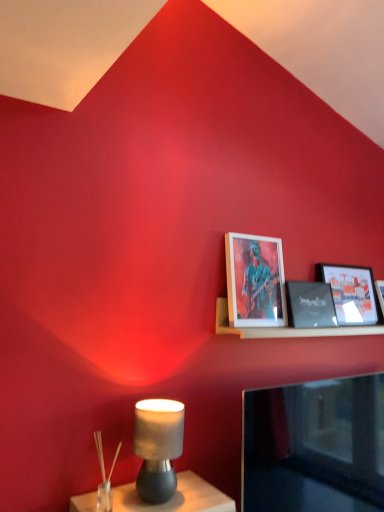
What do you see at coordinates (310, 305) in the screenshot?
I see `matte black picture frame at upper right, the second picture frame viewed from the right` at bounding box center [310, 305].

Where is `matte black picture frame at upper right, the second picture frame viewed from the right`? This screenshot has width=384, height=512. matte black picture frame at upper right, the second picture frame viewed from the right is located at coordinates (310, 305).

This screenshot has height=512, width=384. Identify the location of wooden shelf at upper right. (285, 328).

Identify the location of matte black picture frame at upper right, placed as the third picture frame when sorted from left to right. The width and height of the screenshot is (384, 512). (352, 293).

In the scene shown: In terms of height, does matte gray lamp at lower left look taller or shorter compared to wooden frame at upper right, marked as the 1th picture frame in a left-to-right arrangement?

In the image, matte gray lamp at lower left appears to be shorter than wooden frame at upper right, marked as the 1th picture frame in a left-to-right arrangement.

Is matte gray lamp at lower left wider or thinner than wooden frame at upper right, marked as the 1th picture frame in a left-to-right arrangement?

Clearly, matte gray lamp at lower left has more width compared to wooden frame at upper right, marked as the 1th picture frame in a left-to-right arrangement.

Based on the photo, which is closer to the camera, [176,401] or [268,298]?

Clearly, point [176,401] is closer to the camera than point [268,298].

From a real-world perspective, does matte black picture frame at upper right, acting as the 2th picture frame starting from the left, stand above matte gray lamp at lower left?

Correct, in the physical world, matte black picture frame at upper right, acting as the 2th picture frame starting from the left, is higher than matte gray lamp at lower left.

From the picture: Between matte black picture frame at upper right, acting as the 2th picture frame starting from the left, and matte gray lamp at lower left, which one is positioned behind?

matte black picture frame at upper right, acting as the 2th picture frame starting from the left, is behind.

From the matte gray lamp at lower left, count 2nd picture frame to the right and point to it. Please provide its 2D coordinates.

[(310, 305)]

Is matte black picture frame at upper right, acting as the 2th picture frame starting from the left, positioned far away from matte gray lamp at lower left?

No, matte black picture frame at upper right, acting as the 2th picture frame starting from the left, is in close proximity to matte gray lamp at lower left.

At what (x,y) coordinates should I click in order to perform the action: click on shelf lying on the right of matte black picture frame at upper right, acting as the 2th picture frame starting from the left. Please return your answer as a coordinate pair (x, y). Looking at the image, I should click on (285, 328).

From a real-world perspective, between wooden shelf at upper right and matte black picture frame at upper right, the second picture frame viewed from the right, who is vertically higher?

In real-world perspective, matte black picture frame at upper right, the second picture frame viewed from the right, is above.

Is wooden shelf at upper right oriented towards matte black picture frame at upper right, acting as the 2th picture frame starting from the left?

Yes, wooden shelf at upper right is oriented towards matte black picture frame at upper right, acting as the 2th picture frame starting from the left.

Is wooden shelf at upper right located outside matte black picture frame at upper right, the second picture frame viewed from the right?

wooden shelf at upper right lies outside matte black picture frame at upper right, the second picture frame viewed from the right,'s area.

Is point (320, 330) positioned before point (374, 322)?

Yes, it is.

From a real-world perspective, is wooden shelf at upper right positioned over matte black picture frame at upper right, the 1th picture frame viewed from the right, based on gravity?

Actually, wooden shelf at upper right is physically below matte black picture frame at upper right, the 1th picture frame viewed from the right, in the real world.

Looking at the image, does wooden shelf at upper right seem bigger or smaller compared to matte black picture frame at upper right, the 1th picture frame viewed from the right?

wooden shelf at upper right is bigger than matte black picture frame at upper right, the 1th picture frame viewed from the right.

Is wooden shelf at upper right at the right side of matte black picture frame at upper right, the 1th picture frame viewed from the right?

No, wooden shelf at upper right is not to the right of matte black picture frame at upper right, the 1th picture frame viewed from the right.

Are matte black picture frame at upper right, placed as the third picture frame when sorted from left to right, and black glossy tv at lower right making contact?

No, matte black picture frame at upper right, placed as the third picture frame when sorted from left to right, is not in contact with black glossy tv at lower right.

Where is `picture frame that is the 3rd one when counting backward from the black glossy tv at lower right`? Image resolution: width=384 pixels, height=512 pixels. picture frame that is the 3rd one when counting backward from the black glossy tv at lower right is located at coordinates (352, 293).

Looking at this image, relative to black glossy tv at lower right, is matte black picture frame at upper right, placed as the third picture frame when sorted from left to right, in front or behind?

Visually, matte black picture frame at upper right, placed as the third picture frame when sorted from left to right, is located behind black glossy tv at lower right.

Looking at this image, is matte black picture frame at upper right, the 1th picture frame viewed from the right, not inside black glossy tv at lower right?

Yes, matte black picture frame at upper right, the 1th picture frame viewed from the right, is outside of black glossy tv at lower right.

From a real-world perspective, who is located lower, black glossy tv at lower right or matte black picture frame at upper right, acting as the 2th picture frame starting from the left?

black glossy tv at lower right is physically lower.

Could you measure the distance between black glossy tv at lower right and matte black picture frame at upper right, the second picture frame viewed from the right?

They are 19.45 inches apart.

Is black glossy tv at lower right far away from matte black picture frame at upper right, acting as the 2th picture frame starting from the left?

black glossy tv at lower right is actually quite close to matte black picture frame at upper right, acting as the 2th picture frame starting from the left.

Relative to matte black picture frame at upper right, the second picture frame viewed from the right, is black glossy tv at lower right in front or behind?

Clearly, black glossy tv at lower right is in front of matte black picture frame at upper right, the second picture frame viewed from the right.

From a real-world perspective, is matte black picture frame at upper right, the second picture frame viewed from the right, over matte black picture frame at upper right, the 1th picture frame viewed from the right?

Incorrect, from a real-world perspective, matte black picture frame at upper right, the second picture frame viewed from the right, is lower than matte black picture frame at upper right, the 1th picture frame viewed from the right.

Considering the relative sizes of matte black picture frame at upper right, the second picture frame viewed from the right, and matte black picture frame at upper right, placed as the third picture frame when sorted from left to right, in the image provided, is matte black picture frame at upper right, the second picture frame viewed from the right, taller than matte black picture frame at upper right, placed as the third picture frame when sorted from left to right,?

No, matte black picture frame at upper right, the second picture frame viewed from the right, is not taller than matte black picture frame at upper right, placed as the third picture frame when sorted from left to right.

Considering the relative positions of matte black picture frame at upper right, the second picture frame viewed from the right, and matte black picture frame at upper right, placed as the third picture frame when sorted from left to right, in the image provided, is matte black picture frame at upper right, the second picture frame viewed from the right, to the left of matte black picture frame at upper right, placed as the third picture frame when sorted from left to right, from the viewer's perspective?

Yes, matte black picture frame at upper right, the second picture frame viewed from the right, is to the left of matte black picture frame at upper right, placed as the third picture frame when sorted from left to right.

This screenshot has height=512, width=384. Find the location of `picture frame below the matte black picture frame at upper right, the 1th picture frame viewed from the right (from the image's perspective)`. picture frame below the matte black picture frame at upper right, the 1th picture frame viewed from the right (from the image's perspective) is located at coordinates click(310, 305).

From a real-world perspective, count 3rd picture frames upward from the matte gray lamp at lower left and point to it. Please provide its 2D coordinates.

[(255, 281)]

You are a GUI agent. You are given a task and a screenshot of the screen. Output one action in this format:
    pyautogui.click(x=<x>, y=<y>)
    Task: Click on the table lamp on the left of matte black picture frame at upper right, acting as the 2th picture frame starting from the left
    The image size is (384, 512).
    Given the screenshot: What is the action you would take?
    point(158,447)

Based on their spatial positions, is wooden frame at upper right, marked as the 1th picture frame in a left-to-right arrangement, or black glossy tv at lower right further from wooden shelf at upper right?

Among the two, black glossy tv at lower right is located further to wooden shelf at upper right.

Estimate the real-world distances between objects in this image. Which object is further from matte black picture frame at upper right, the 1th picture frame viewed from the right, wooden shelf at upper right or black glossy tv at lower right?

Among the two, black glossy tv at lower right is located further to matte black picture frame at upper right, the 1th picture frame viewed from the right.

Looking at the image, which one is located further to matte gray lamp at lower left, black glossy tv at lower right or wooden frame at upper right, marked as the 1th picture frame in a left-to-right arrangement?

The object further to matte gray lamp at lower left is wooden frame at upper right, marked as the 1th picture frame in a left-to-right arrangement.

Which object lies nearer to the anchor point black glossy tv at lower right, matte gray lamp at lower left or wooden shelf at upper right?

The object closer to black glossy tv at lower right is wooden shelf at upper right.

Estimate the real-world distances between objects in this image. Which object is closer to wooden shelf at upper right, black glossy tv at lower right or wooden frame at upper right, acting as the 3th picture frame starting from the right?

Based on the image, wooden frame at upper right, acting as the 3th picture frame starting from the right, appears to be nearer to wooden shelf at upper right.

Estimate the real-world distances between objects in this image. Which object is further from matte gray lamp at lower left, black glossy tv at lower right or matte black picture frame at upper right, the second picture frame viewed from the right?

Among the two, matte black picture frame at upper right, the second picture frame viewed from the right, is located further to matte gray lamp at lower left.

Looking at the image, which one is located closer to matte gray lamp at lower left, wooden shelf at upper right or matte black picture frame at upper right, placed as the third picture frame when sorted from left to right?

wooden shelf at upper right.

From the picture: When comparing their distances from matte black picture frame at upper right, the second picture frame viewed from the right, does black glossy tv at lower right or wooden shelf at upper right seem further?

black glossy tv at lower right.

Where is `shelf between wooden frame at upper right, marked as the 1th picture frame in a left-to-right arrangement, and matte black picture frame at upper right, placed as the third picture frame when sorted from left to right, from left to right`? Image resolution: width=384 pixels, height=512 pixels. shelf between wooden frame at upper right, marked as the 1th picture frame in a left-to-right arrangement, and matte black picture frame at upper right, placed as the third picture frame when sorted from left to right, from left to right is located at coordinates (285, 328).

This screenshot has height=512, width=384. Identify the location of shelf between wooden frame at upper right, acting as the 3th picture frame starting from the right, and black glossy tv at lower right vertically. (285, 328).

The image size is (384, 512). Find the location of `shelf that lies between matte black picture frame at upper right, placed as the third picture frame when sorted from left to right, and black glossy tv at lower right from top to bottom`. shelf that lies between matte black picture frame at upper right, placed as the third picture frame when sorted from left to right, and black glossy tv at lower right from top to bottom is located at coordinates (285, 328).

At what (x,y) coordinates should I click in order to perform the action: click on shelf located between matte gray lamp at lower left and matte black picture frame at upper right, the 1th picture frame viewed from the right, in the left-right direction. Please return your answer as a coordinate pair (x, y). This screenshot has height=512, width=384. Looking at the image, I should click on (285, 328).